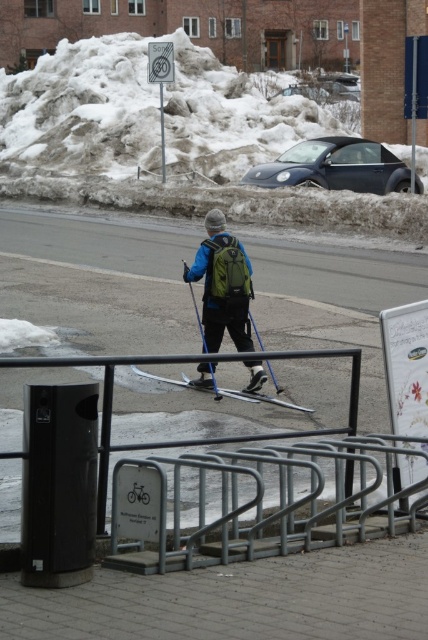
Does gray concrete pavement at center have a greater height compared to blue plastic ski pole at center?

Indeed, gray concrete pavement at center has a greater height compared to blue plastic ski pole at center.

Looking at this image, can you confirm if gray concrete pavement at center is positioned to the left of blue plastic ski pole at center?

Yes, gray concrete pavement at center is to the left of blue plastic ski pole at center.

Image resolution: width=428 pixels, height=640 pixels. What are the coordinates of `gray concrete pavement at center` in the screenshot? It's located at (101, 307).

Between silver metallic skis at center and brushed metal pole at upper center, which one appears on the left side from the viewer's perspective?

brushed metal pole at upper center is more to the left.

Is silver metallic skis at center taller than brushed metal pole at upper center?

Incorrect, silver metallic skis at center's height is not larger of brushed metal pole at upper center's.

This screenshot has height=640, width=428. In order to click on silver metallic skis at center in this screenshot , I will do `click(259, 397)`.

Measure the distance between gray metallic bike rack at lower center and camera.

gray metallic bike rack at lower center is 6.05 meters from camera.

What do you see at coordinates (264, 500) in the screenshot? I see `gray metallic bike rack at lower center` at bounding box center [264, 500].

Between point (269, 448) and point (281, 401), which one is positioned in front?

Point (269, 448) is more forward.

Image resolution: width=428 pixels, height=640 pixels. Find the location of `gray metallic bike rack at lower center`. gray metallic bike rack at lower center is located at coordinates (264, 500).